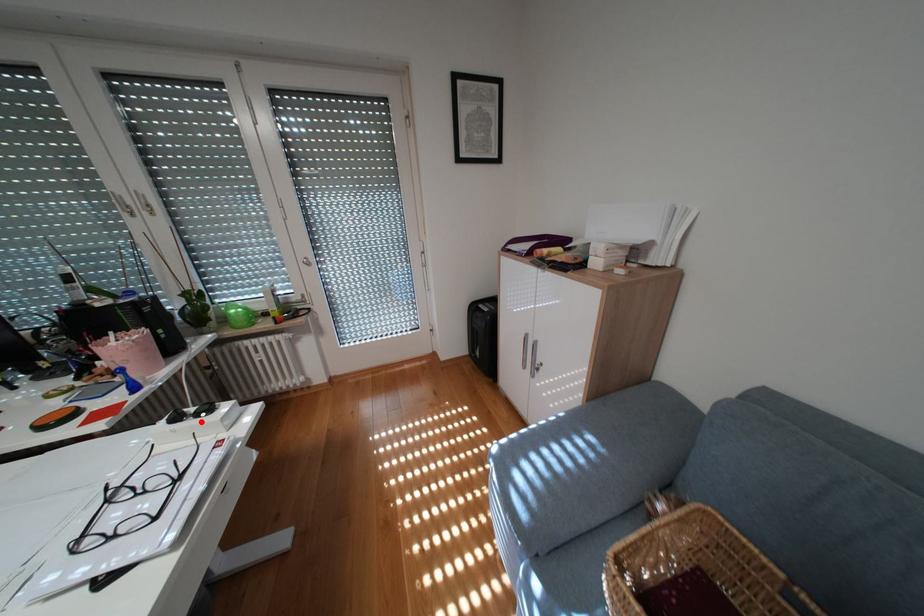
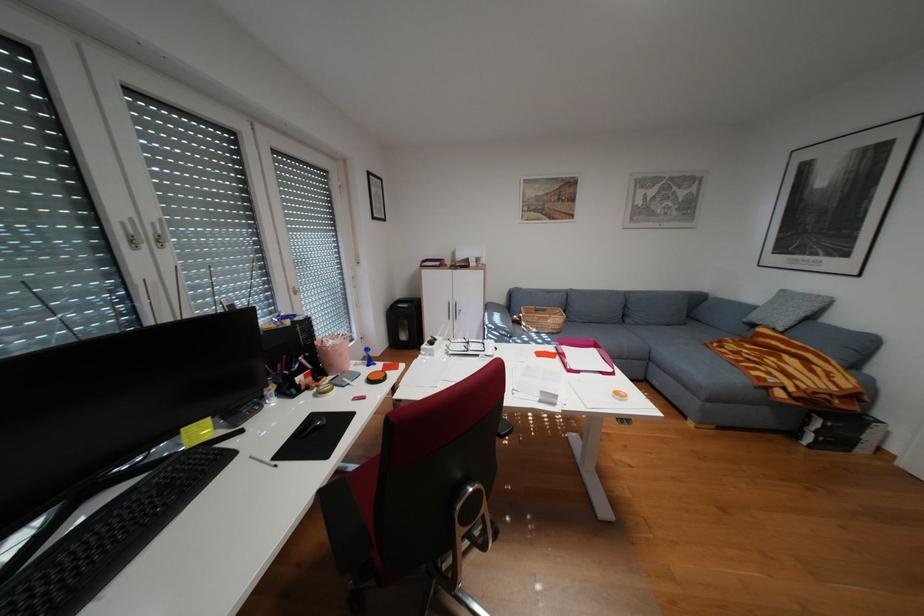
Locate, in the second image, the point that corresponds to the highlighted location in the first image.

(448, 342)